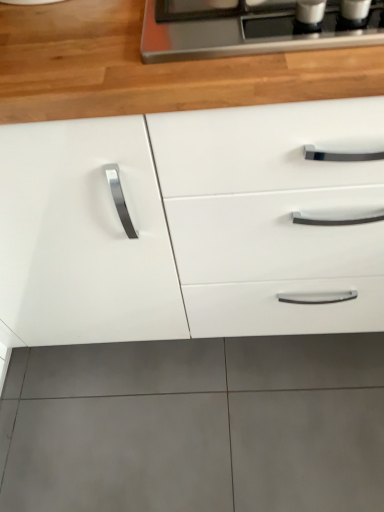
Question: From the image's perspective, is white glossy cabinet at center located above wooden at upper center?

Choices:
 (A) no
 (B) yes

Answer: (A)

Question: From a real-world perspective, is white glossy cabinet at center positioned over wooden at upper center based on gravity?

Choices:
 (A) no
 (B) yes

Answer: (A)

Question: Considering the relative positions of white glossy cabinet at center and wooden at upper center in the image provided, is white glossy cabinet at center in front of wooden at upper center?

Choices:
 (A) no
 (B) yes

Answer: (B)

Question: From a real-world perspective, does white glossy cabinet at center sit lower than wooden at upper center?

Choices:
 (A) yes
 (B) no

Answer: (A)

Question: Does white glossy cabinet at center have a larger size compared to wooden at upper center?

Choices:
 (A) yes
 (B) no

Answer: (A)

Question: Would you say white glossy cabinet at center is outside wooden at upper center?

Choices:
 (A) no
 (B) yes

Answer: (B)

Question: Is wooden at upper center located outside white glossy cabinet at center?

Choices:
 (A) yes
 (B) no

Answer: (B)

Question: From a real-world perspective, is wooden at upper center physically above white glossy cabinet at center?

Choices:
 (A) no
 (B) yes

Answer: (B)

Question: Is wooden at upper center looking in the opposite direction of white glossy cabinet at center?

Choices:
 (A) yes
 (B) no

Answer: (A)

Question: Would you consider wooden at upper center to be distant from white glossy cabinet at center?

Choices:
 (A) no
 (B) yes

Answer: (A)

Question: Can you confirm if wooden at upper center is taller than white glossy cabinet at center?

Choices:
 (A) yes
 (B) no

Answer: (B)

Question: Considering the relative sizes of wooden at upper center and white glossy cabinet at center in the image provided, is wooden at upper center wider than white glossy cabinet at center?

Choices:
 (A) yes
 (B) no

Answer: (B)

Question: From a real-world perspective, is wooden at upper center physically located above or below white glossy cabinet at center?

Choices:
 (A) above
 (B) below

Answer: (A)